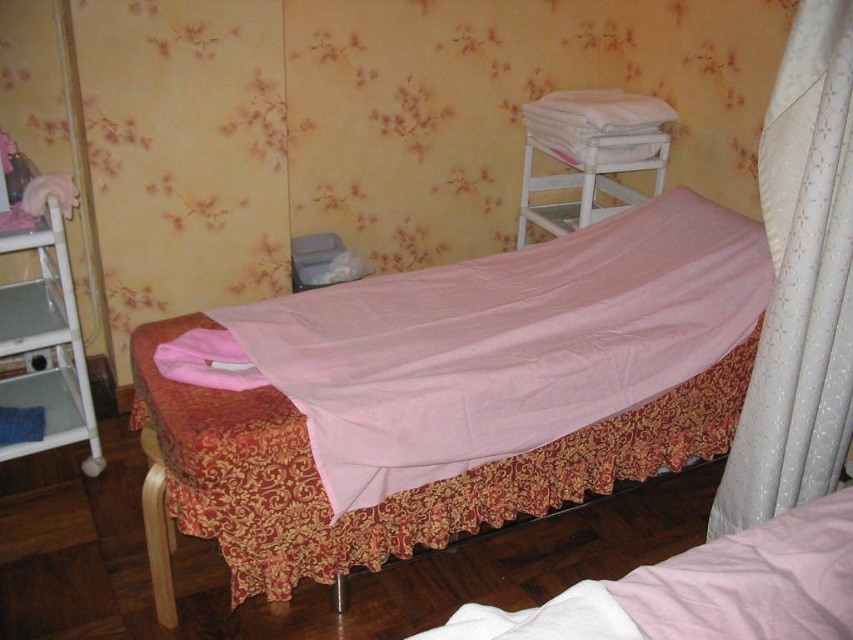
Between satin white curtain at right and matte pink fabric at left, which one is positioned lower?

satin white curtain at right is below.

How much distance is there between satin white curtain at right and matte pink fabric at left?

satin white curtain at right is 5.73 feet from matte pink fabric at left.

Does point (848, 419) come farther from viewer compared to point (51, 413)?

No.

Where is `satin white curtain at right`? satin white curtain at right is located at coordinates (799, 284).

How far apart are pink satin bed at center and satin white curtain at right?

A distance of 59.66 centimeters exists between pink satin bed at center and satin white curtain at right.

Is point (271, 406) positioned before point (815, 172)?

No, it is behind (815, 172).

Is point (740, 371) in front of point (798, 184)?

No, it is behind (798, 184).

What are the coordinates of `pink satin bed at center` in the screenshot? It's located at (461, 392).

Can you confirm if pink satin bed at center is shorter than matte pink fabric at left?

Incorrect, pink satin bed at center's height does not fall short of matte pink fabric at left's.

Based on the photo, who is taller, pink satin bed at center or matte pink fabric at left?

Standing taller between the two is pink satin bed at center.

The width and height of the screenshot is (853, 640). I want to click on pink satin bed at center, so click(x=461, y=392).